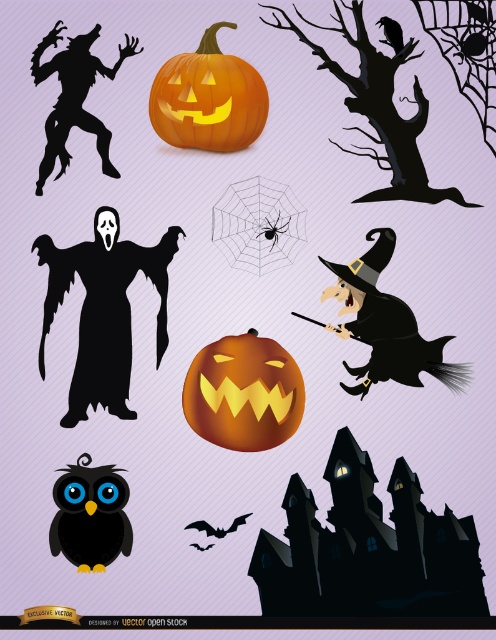
Question: Does matte orange pumpkin at center have a greater width compared to black matte/soft owl at lower left?

Choices:
 (A) yes
 (B) no

Answer: (A)

Question: Does matte orange pumpkin at center appear on the right side of black matte witch at upper center?

Choices:
 (A) yes
 (B) no

Answer: (A)

Question: Which object appears closest to the camera in this image?

Choices:
 (A) matte orange pumpkin at center
 (B) black matte witch at upper center
 (C) orange matte pumpkin at upper center
 (D) black matte/soft owl at lower left

Answer: (D)

Question: Which is nearer to the orange matte pumpkin at upper center?

Choices:
 (A) black matte/soft owl at lower left
 (B) matte orange pumpkin at center
 (C) black matte witch at upper center

Answer: (C)

Question: Which object is the farthest from the black matte/soft owl at lower left?

Choices:
 (A) black matte witch at upper center
 (B) matte orange pumpkin at center

Answer: (A)

Question: Does matte orange pumpkin at center appear over black matte/soft owl at lower left?

Choices:
 (A) no
 (B) yes

Answer: (B)